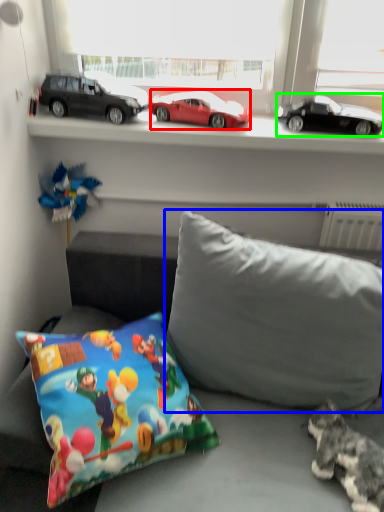
Question: Considering the real-world distances, which object is closest to car (highlighted by a red box)? pillow (highlighted by a blue box) or car (highlighted by a green box).

Choices:
 (A) pillow
 (B) car

Answer: (B)